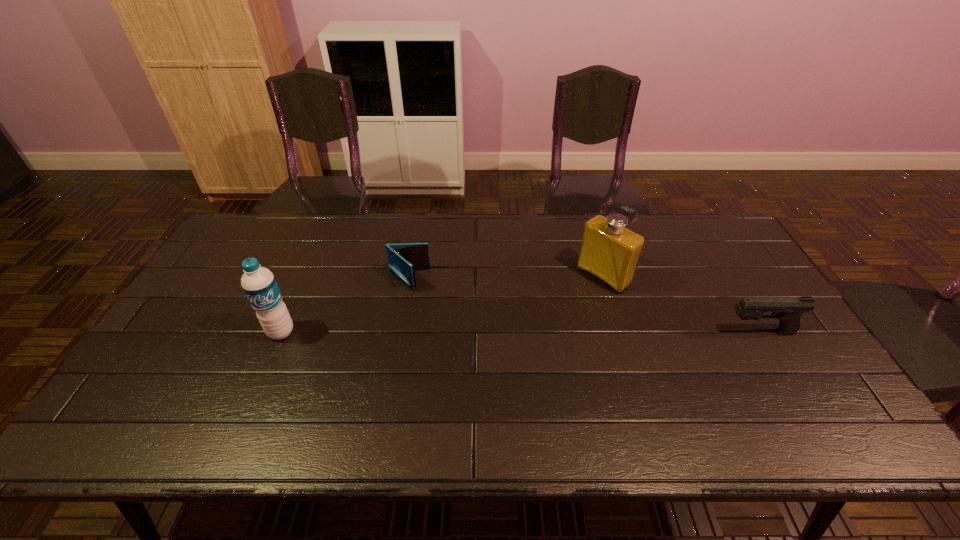
The height and width of the screenshot is (540, 960). I want to click on unoccupied area between the water bottle and the rightmost object, so click(520, 332).

At what (x,y) coordinates should I click in order to perform the action: click on empty location between the second shortest object and the leftmost object. Please return your answer as a coordinate pair (x, y). Looking at the image, I should click on (520, 332).

Where is `free space between the shortest object and the second object from right to left`? Image resolution: width=960 pixels, height=540 pixels. free space between the shortest object and the second object from right to left is located at coordinates (506, 278).

Identify which object is the closest to the third tallest object. Please provide its 2D coordinates. Your answer should be formatted as a tuple, i.e. [(x, y)], where the tuple contains the x and y coordinates of a point satisfying the conditions above.

[(610, 252)]

The width and height of the screenshot is (960, 540). What are the coordinates of `object that is the second nearest to the second object from right to left` in the screenshot? It's located at (404, 258).

You are a GUI agent. You are given a task and a screenshot of the screen. Output one action in this format:
    pyautogui.click(x=<x>, y=<y>)
    Task: Click on the free location that satisfies the following two spatial constraints: 1. on the front side of the rightmost object; 2. at the barrel of the perfume
    
    Given the screenshot: What is the action you would take?
    pyautogui.click(x=620, y=332)

Locate an element on the screen. free space in the image that satisfies the following two spatial constraints: 1. on the front side of the second shortest object; 2. at the barrel of the wallet is located at coordinates (399, 332).

This screenshot has width=960, height=540. What are the coordinates of `free space that satisfies the following two spatial constraints: 1. on the label of the leftmost object; 2. at the barrel of the pistol` in the screenshot? It's located at (281, 332).

This screenshot has height=540, width=960. Identify the location of free space that satisfies the following two spatial constraints: 1. on the label of the leftmost object; 2. at the barrel of the rightmost object. (281, 332).

What are the coordinates of `vacant space that satisfies the following two spatial constraints: 1. on the label of the pistol; 2. at the barrel of the water bottle` in the screenshot? It's located at (281, 332).